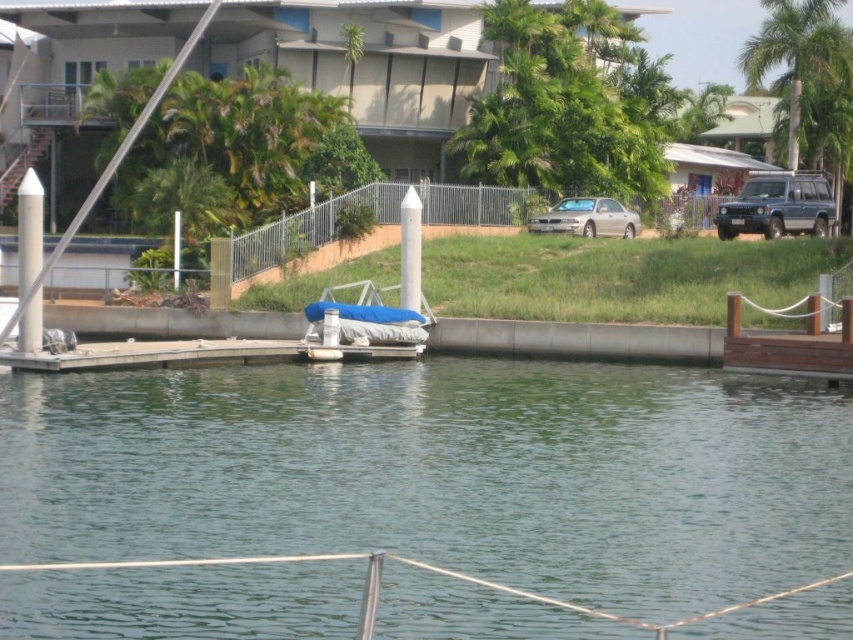
Is point (358, 376) farther from camera compared to point (573, 209)?

No.

From the picture: Who is lower down, green water at center or satin silver car at center?

green water at center is below.

Image resolution: width=853 pixels, height=640 pixels. What do you see at coordinates (412, 488) in the screenshot?
I see `green water at center` at bounding box center [412, 488].

Identify the location of green water at center. The width and height of the screenshot is (853, 640). (412, 488).

Who is positioned more to the left, green leafy palm tree at upper right or brown wooden dock at right?

Positioned to the left is brown wooden dock at right.

Identify the location of green leafy palm tree at upper right. (798, 52).

Between silver metallic suv at upper right and satin silver car at center, which one has less height?

silver metallic suv at upper right is shorter.

At what (x,y) coordinates should I click in order to perform the action: click on silver metallic suv at upper right. Please return your answer as a coordinate pair (x, y). Looking at the image, I should click on (778, 205).

Locate an element on the screen. The width and height of the screenshot is (853, 640). silver metallic suv at upper right is located at coordinates (778, 205).